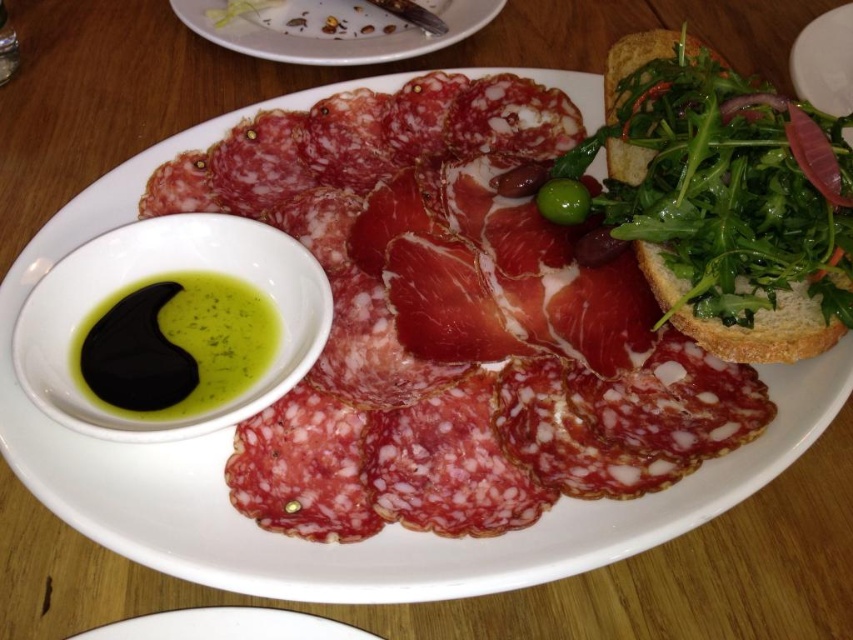
Question: Is black oil at lower left smaller than white ceramic plate at upper center?

Choices:
 (A) yes
 (B) no

Answer: (A)

Question: Can you confirm if black oil at lower left is positioned above green glossy olive at upper center?

Choices:
 (A) no
 (B) yes

Answer: (A)

Question: Estimate the real-world distances between objects in this image. Which object is closer to the black oil at lower left?

Choices:
 (A) green glossy olive at upper center
 (B) white ceramic plate at upper center

Answer: (A)

Question: Which point is farther from the camera taking this photo?

Choices:
 (A) (274, 310)
 (B) (558, 212)
 (C) (281, 44)
 (D) (611, 154)

Answer: (C)

Question: Which point appears farthest from the camera in this image?

Choices:
 (A) (323, 42)
 (B) (561, 189)
 (C) (637, 49)
 (D) (222, 326)

Answer: (A)

Question: Can you confirm if black oil at lower left is bigger than green glossy olive at upper center?

Choices:
 (A) yes
 (B) no

Answer: (A)